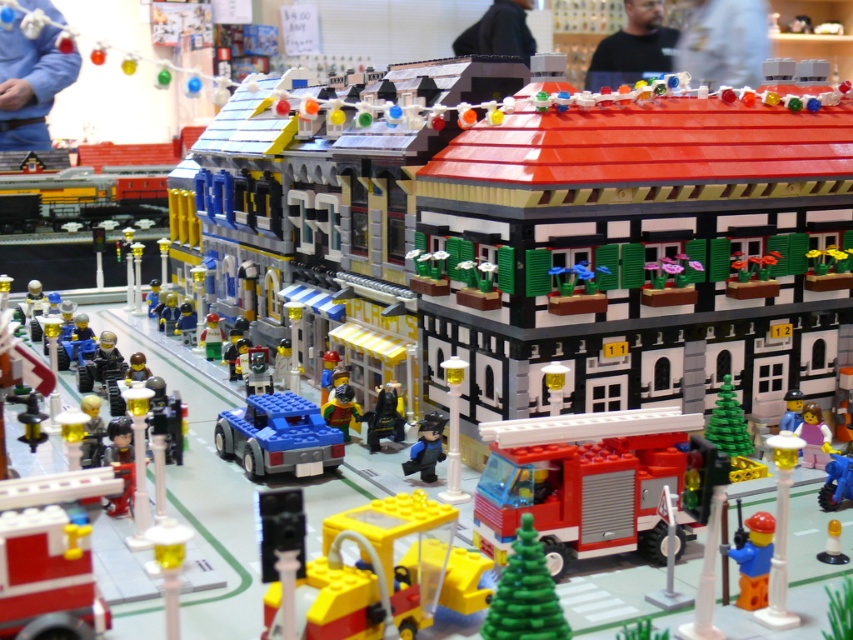
You are a Lego figure trying to walk from the left side of the brick red fire truck at center to the right side of the matte black figure at center. Can you pass through the space between them without touching either?

The brick red fire truck at center might be wider than matte black figure at center, so there might not be enough space to pass through without touching either.